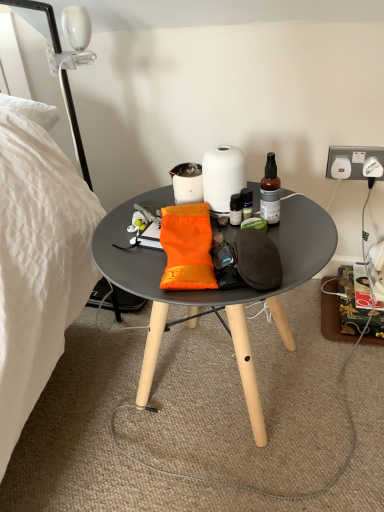
Question: Relative to translucent glass bottle at upper right, is white plastic power outlet at upper right in front or behind?

Choices:
 (A) behind
 (B) front

Answer: (A)

Question: Considering the relative positions of white plastic power outlet at upper right and translucent glass bottle at upper right in the image provided, is white plastic power outlet at upper right to the left or to the right of translucent glass bottle at upper right?

Choices:
 (A) right
 (B) left

Answer: (A)

Question: Which object is the farthest from the white plastic power outlet at upper right?

Choices:
 (A) white glossy lamp at upper left
 (B) orange fabric pouch at center
 (C) matte white coffee cup at center
 (D) matte black table at center
 (E) translucent glass bottle at upper right

Answer: (A)

Question: Which of these objects is positioned farthest from the matte black table at center?

Choices:
 (A) white glossy lamp at upper left
 (B) translucent glass bottle at upper right
 (C) white matte paper towel at center
 (D) orange fabric pouch at center
 (E) matte white coffee cup at center

Answer: (A)